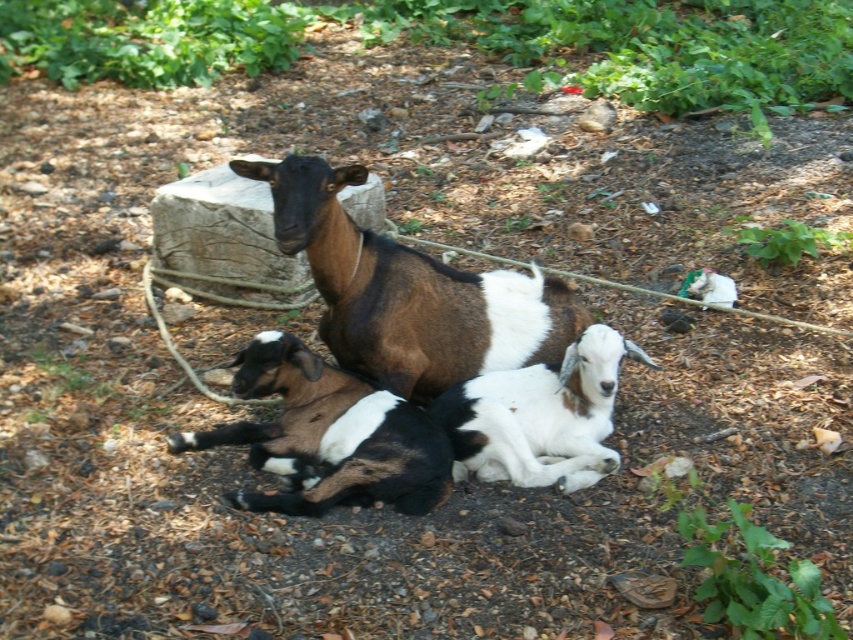
Is black and white fur at center above white soft fur goat at center?

No, black and white fur at center is not above white soft fur goat at center.

Who is positioned more to the right, black and white fur at center or white soft fur goat at center?

Positioned to the right is white soft fur goat at center.

Find the location of a particular element. black and white fur at center is located at coordinates (328, 436).

Does brown/white fur goat at center have a lesser height compared to white soft fur goat at center?

Incorrect, brown/white fur goat at center's height does not fall short of white soft fur goat at center's.

In the scene shown: Does brown/white fur goat at center have a greater width compared to white soft fur goat at center?

Indeed, brown/white fur goat at center has a greater width compared to white soft fur goat at center.

In order to click on brown/white fur goat at center in this screenshot , I will do `click(408, 292)`.

This screenshot has width=853, height=640. What are the coordinates of `brown/white fur goat at center` in the screenshot? It's located at (408, 292).

Can you confirm if brown/white fur goat at center is shorter than black and white fur at center?

No, brown/white fur goat at center is not shorter than black and white fur at center.

The image size is (853, 640). What do you see at coordinates (408, 292) in the screenshot?
I see `brown/white fur goat at center` at bounding box center [408, 292].

Does point (566, 333) come closer to viewer compared to point (322, 403)?

No, it is not.

Where is `brown/white fur goat at center`? This screenshot has height=640, width=853. brown/white fur goat at center is located at coordinates (408, 292).